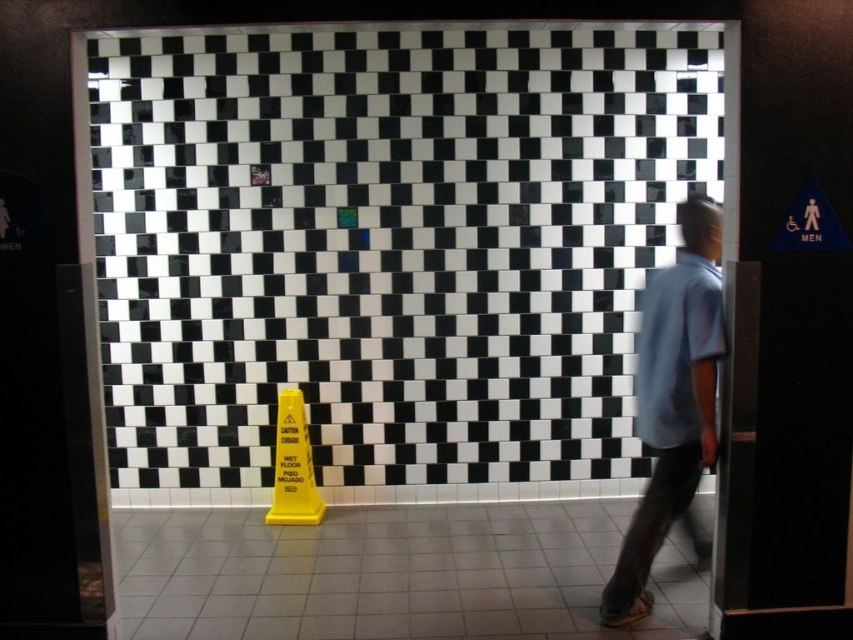
Is black glossy tile at center smaller than light blue t-shirt at right?

Incorrect, black glossy tile at center is not smaller in size than light blue t-shirt at right.

Who is positioned more to the right, black glossy tile at center or light blue t-shirt at right?

light blue t-shirt at right

Which is behind, point (535, 49) or point (706, 316)?

The point (535, 49) is behind.

Where is `black glossy tile at center`? black glossy tile at center is located at coordinates pyautogui.click(x=387, y=250).

Between point (619, 630) and point (630, 548), which one is positioned behind?

Point (630, 548)

At what (x,y) coordinates should I click in order to perform the action: click on white tile at lower center. Please return your answer as a coordinate pair (x, y). Image resolution: width=853 pixels, height=640 pixels. Looking at the image, I should click on (392, 573).

Does black glossy tile at center appear on the left side of white tile at lower center?

Incorrect, black glossy tile at center is not on the left side of white tile at lower center.

From the picture: Is black glossy tile at center positioned at the back of white tile at lower center?

Yes.

The image size is (853, 640). What do you see at coordinates (387, 250) in the screenshot? I see `black glossy tile at center` at bounding box center [387, 250].

The image size is (853, 640). I want to click on black glossy tile at center, so click(x=387, y=250).